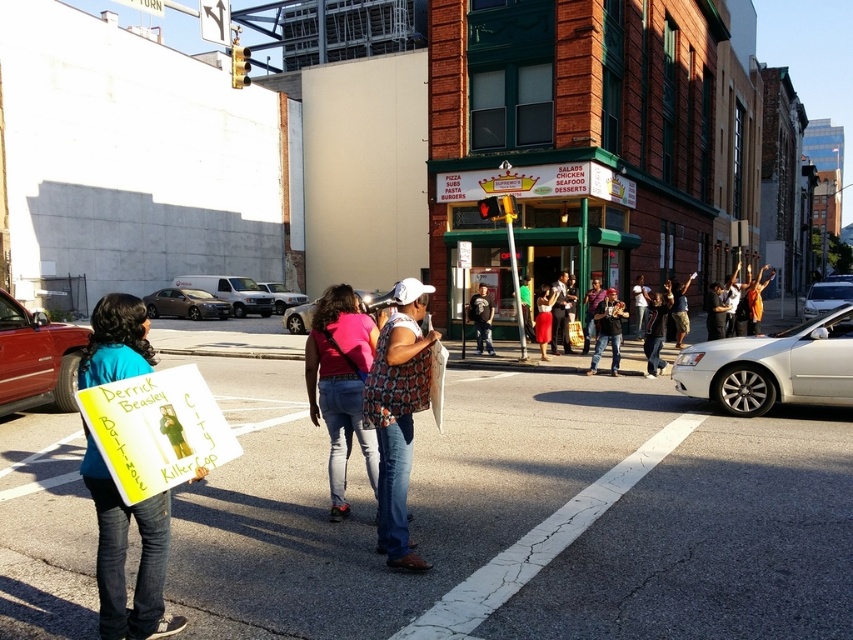
Question: Which of the following is the farthest from the observer?

Choices:
 (A) (843, 403)
 (B) (296, 304)
 (C) (346, 502)
 (D) (183, 289)

Answer: (B)

Question: Which of the following is the farthest from the observer?

Choices:
 (A) silver metallic van at center
 (B) silver metallic sedan at center-right
 (C) matte black sedan at center
 (D) patterned fabric vest at center

Answer: (A)

Question: Is blue denim jeans at lower left to the right of dark blue jeans at center from the viewer's perspective?

Choices:
 (A) yes
 (B) no

Answer: (B)

Question: Can you confirm if shiny red truck at left is thinner than silver metallic sedan at center-right?

Choices:
 (A) no
 (B) yes

Answer: (B)

Question: Which object appears farthest from the camera in this image?

Choices:
 (A) matte pink shirt at center
 (B) blue denim jeans at lower left

Answer: (A)

Question: Is matte pink shirt at center bigger than silver metallic van at center?

Choices:
 (A) no
 (B) yes

Answer: (B)